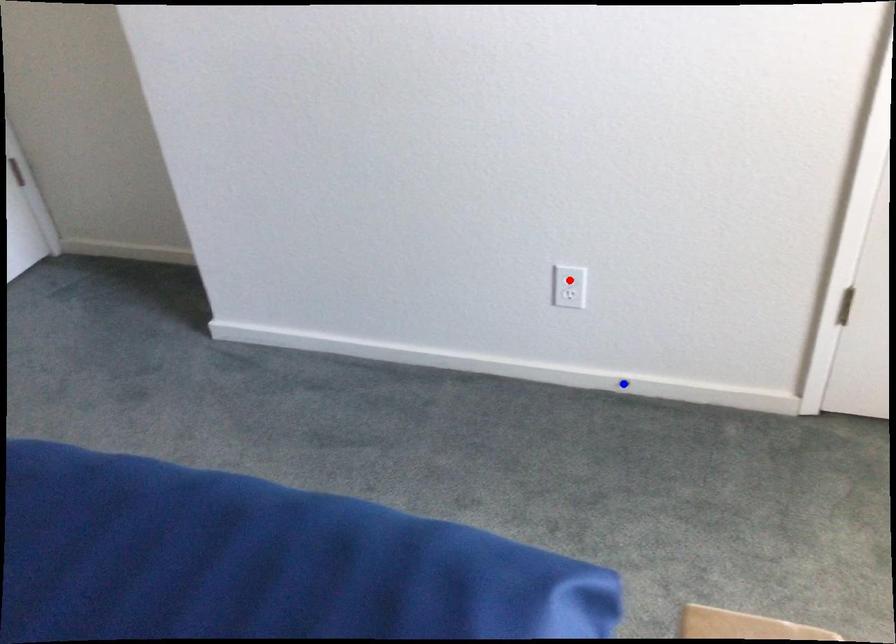
Question: Which of the two points in the image is closer to the camera?

Choices:
 (A) Blue point is closer.
 (B) Red point is closer.

Answer: (B)